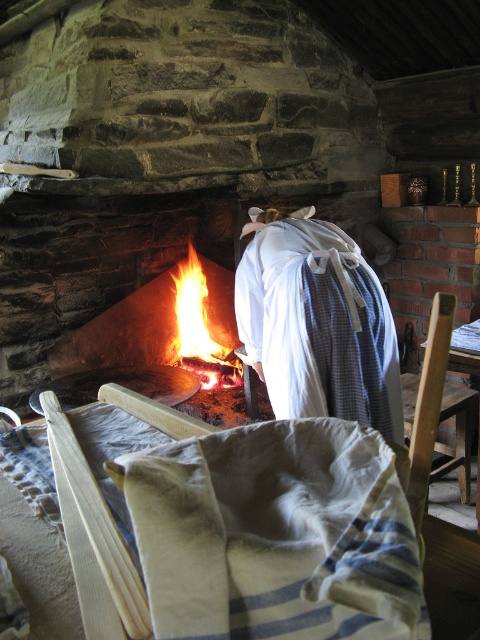
Can you confirm if flaming wood fire at center is positioned above wooden chair at lower right?

Yes, flaming wood fire at center is above wooden chair at lower right.

Describe the element at coordinates (200, 326) in the screenshot. I see `flaming wood fire at center` at that location.

You are a GUI agent. You are given a task and a screenshot of the screen. Output one action in this format:
    pyautogui.click(x=<x>, y=<y>)
    Task: Click on the flaming wood fire at center
    The width and height of the screenshot is (480, 640).
    Given the screenshot: What is the action you would take?
    pyautogui.click(x=200, y=326)

Does white cotton cloth at center appear over flaming wood fire at center?

No.

This screenshot has height=640, width=480. In order to click on white cotton cloth at center in this screenshot , I will do `click(276, 534)`.

From the picture: Is white cotton cloth at center shorter than white cotton apron at center?

Yes, white cotton cloth at center is shorter than white cotton apron at center.

You are a GUI agent. You are given a task and a screenshot of the screen. Output one action in this format:
    pyautogui.click(x=<x>, y=<y>)
    Task: Click on the white cotton cloth at center
    
    Given the screenshot: What is the action you would take?
    pyautogui.click(x=276, y=534)

Image resolution: width=480 pixels, height=640 pixels. In order to click on white cotton cloth at center in this screenshot , I will do `click(276, 534)`.